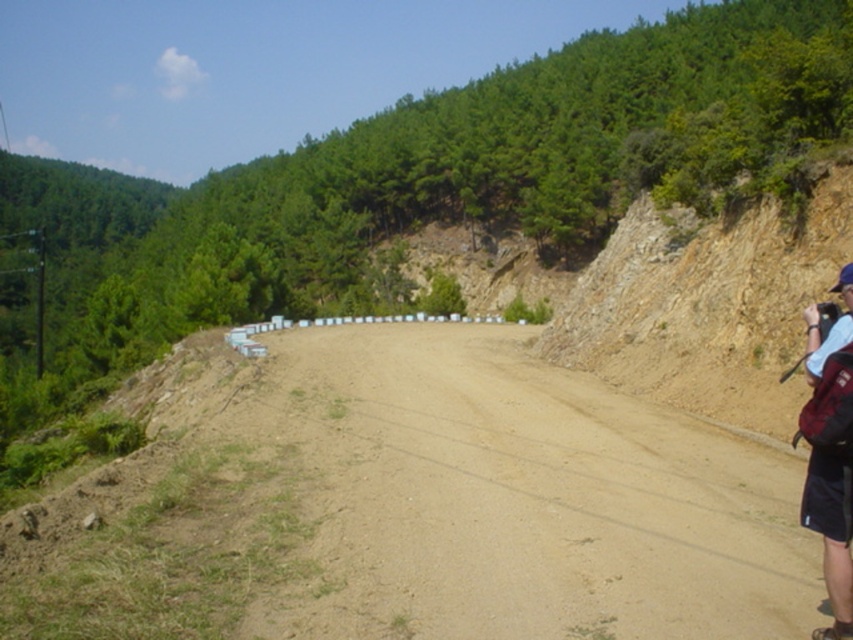
You are a hiker who needs to place your dark blue backpack at right on the brown sandy dirt track at center. Can you fit it there without any part of the backpack hanging off the track?

The brown sandy dirt track at center is bigger than the dark blue backpack at right, so yes, the backpack will fit entirely on the track without any part hanging off.

You are a hiker who has just finished a long trek and needs to decide whether to place your dark blue backpack at right on the brown sandy dirt track at center. Based on the scene, will the backpack fit entirely on the track?

The brown sandy dirt track at center is shorter than the dark blue backpack at right, so the backpack will not fit entirely on the track.

You are a hiker who has just spotted a dark blue backpack at right and a brown sandy dirt track at center. Which object is lower in elevation?

The brown sandy dirt track at center is located below the dark blue backpack at right, so it is lower in elevation.